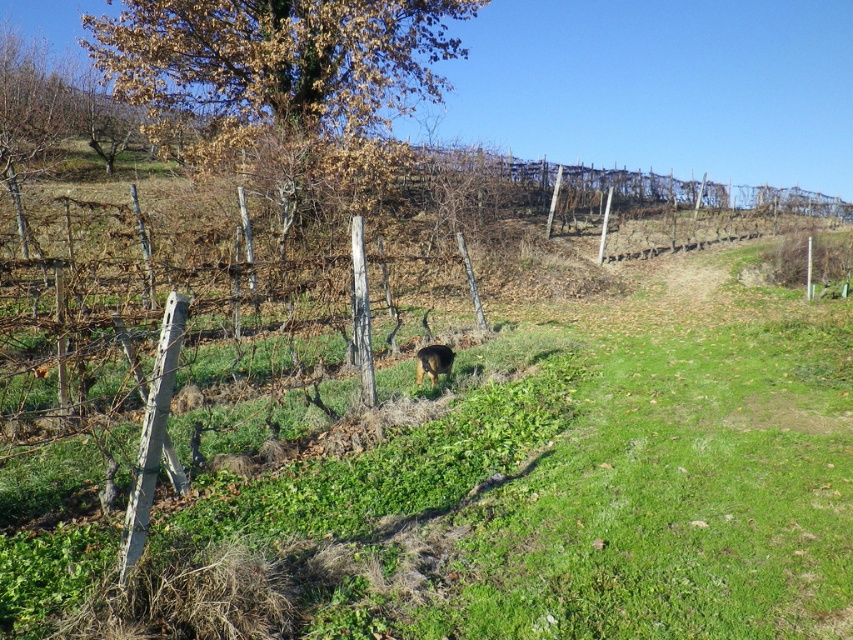
You are standing in the vineyard and see the brown leafy tree at upper left and the brown furry dog at center. Which object is positioned to the left of the other?

The brown leafy tree at upper left is to the left of the brown furry dog at center.

You are standing at the entrance of the vineyard and want to locate the brown leafy tree at upper left. According to your GPS coordinates, where should you look to find it?

The brown leafy tree at upper left is located at coordinates point (277, 58).

You are standing in the vineyard looking at the brown leafy tree at upper left and the brown furry dog at center. Which object is positioned higher in the image?

The brown leafy tree at upper left is located above the brown furry dog at center, so it is positioned higher in the image.